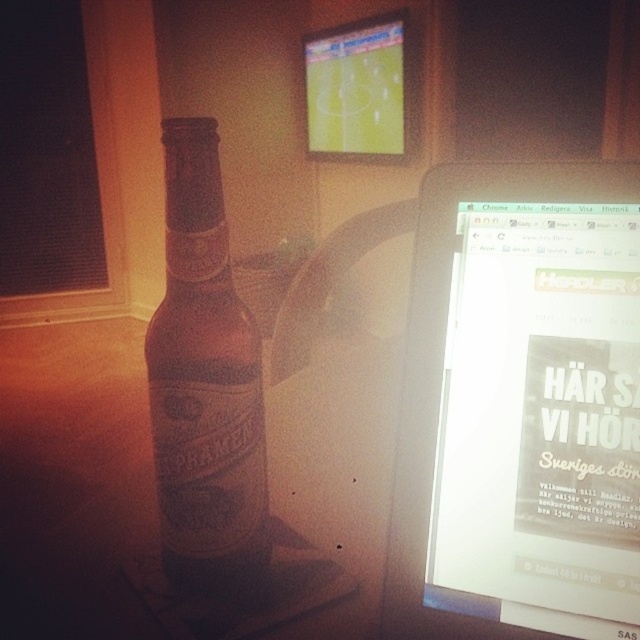
Question: Based on their relative distances, which object is farther from the brown glass bottle at left?

Choices:
 (A) white glossy computer monitor at upper right
 (B) matte plastic screen at upper center

Answer: (B)

Question: Does brown glass bottle at left have a larger size compared to matte plastic screen at upper center?

Choices:
 (A) no
 (B) yes

Answer: (A)

Question: From the image, what is the correct spatial relationship of brown glass bottle at left in relation to matte plastic screen at upper center?

Choices:
 (A) below
 (B) above

Answer: (A)

Question: Is white glossy computer monitor at upper right above matte plastic screen at upper center?

Choices:
 (A) no
 (B) yes

Answer: (A)

Question: Which is farther from the matte plastic screen at upper center?

Choices:
 (A) brown glass bottle at left
 (B) white glossy computer monitor at upper right

Answer: (B)

Question: Among these points, which one is nearest to the camera?

Choices:
 (A) (385, 49)
 (B) (502, 508)
 (C) (202, 300)

Answer: (B)